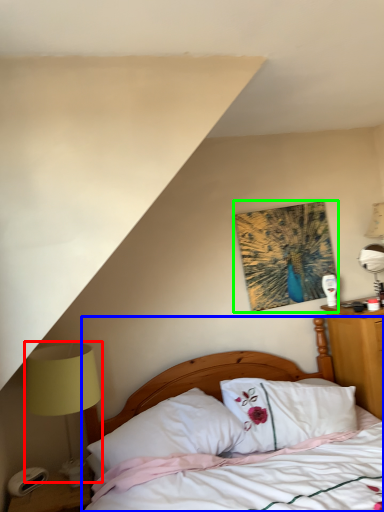
Question: Which object is the closest to the bedside lamp (highlighted by a red box)? Choose among these: bed (highlighted by a blue box) or picture frame (highlighted by a green box).

Choices:
 (A) bed
 (B) picture frame

Answer: (A)